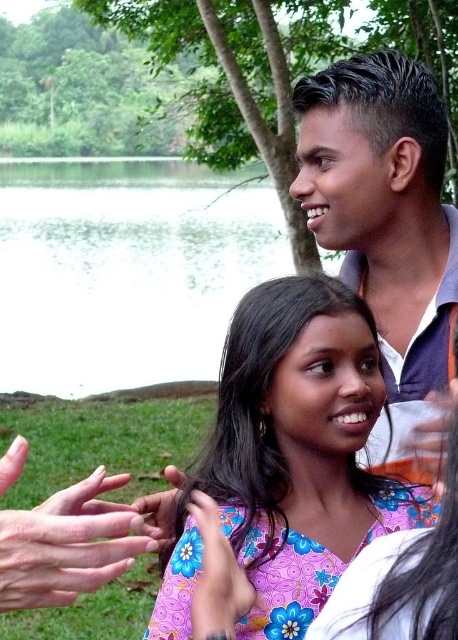
You are a photographer trying to capture a candid shot of the two people in the scene. You want to ensure that both the floral fabric dress at center and the smooth skin hand at lower left are in focus. Given that your camera has a depth of field that can cover 15 inches, will you be able to achieve this?

The distance between the floral fabric dress at center and the smooth skin hand at lower left is 13.31 inches, which is within the camera depth of field of 15 inches. Therefore, both objects will be in focus.

You are a photographer trying to capture the interaction between the two people. The green water at center is blocking your view of the smooth skin hand at lower left. Can you adjust your position to see the hand without moving the subjects?

The smooth skin hand at lower left is behind the green water at center, so moving your camera position slightly to the side might allow you to see the hand without obstruction.

You are an event planner organizing a photoshoot and need to place two outfits in the scene. The floral fabric dress at center and the matte purple shirt at upper right must be positioned such that they do not overlap. Given their sizes, which outfit should be placed closer to the edge to ensure they both fit within the frame?

The floral fabric dress at center has a larger width than the matte purple shirt at upper right. To prevent overlapping and ensure both fit in the frame, the wider floral fabric dress at center should be placed closer to the center, while the narrower matte purple shirt at upper right can be positioned near the edge.